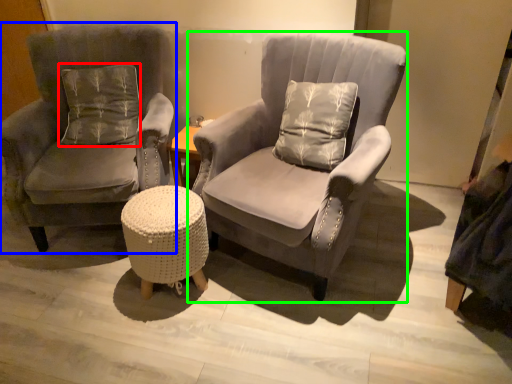
Question: Based on their relative distances, which object is nearer to pillow (highlighted by a red box)? Choose from chair (highlighted by a blue box) and chair (highlighted by a green box).

Choices:
 (A) chair
 (B) chair

Answer: (A)